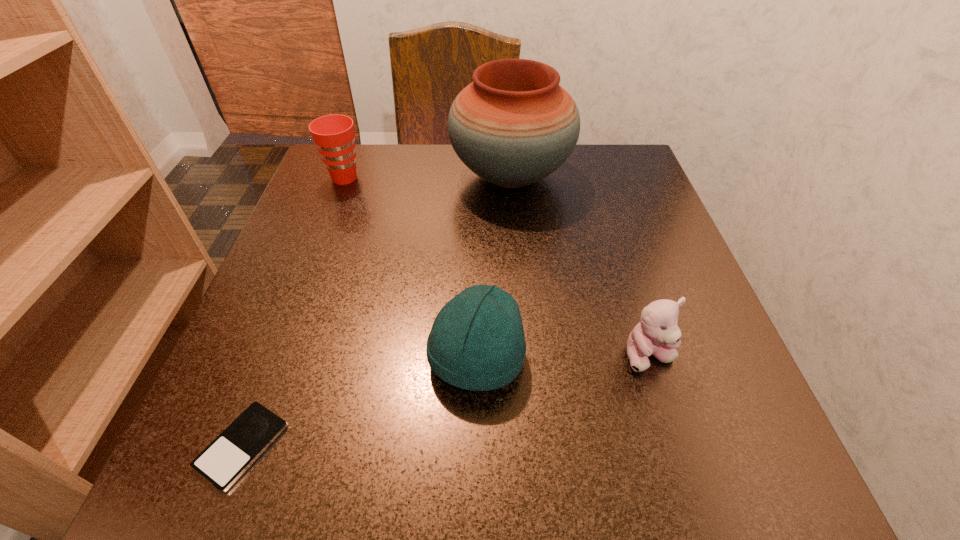
In order to click on free space located on the back of the nearest object in this screenshot , I will do 310,267.

The width and height of the screenshot is (960, 540). Find the location of `pottery at the far edge`. pottery at the far edge is located at coordinates (514, 125).

Identify the location of cup located at the far edge. This screenshot has height=540, width=960. [334, 136].

At what (x,y) coordinates should I click in order to perform the action: click on object that is at the near edge. Please return your answer as a coordinate pair (x, y). Looking at the image, I should click on (227, 457).

Where is `cup situated at the left edge`? The height and width of the screenshot is (540, 960). cup situated at the left edge is located at coordinates (334, 136).

The width and height of the screenshot is (960, 540). What are the coordinates of `iPod that is at the left edge` in the screenshot? It's located at (227, 457).

At what (x,y) coordinates should I click in order to perform the action: click on object that is at the right edge. Please return your answer as a coordinate pair (x, y). Image resolution: width=960 pixels, height=540 pixels. Looking at the image, I should click on (657, 334).

Locate an element on the screen. This screenshot has width=960, height=540. object that is at the far left corner is located at coordinates (334, 136).

Where is `object located in the near left corner section of the desktop`? The image size is (960, 540). object located in the near left corner section of the desktop is located at coordinates (227, 457).

At what (x,y) coordinates should I click in order to perform the action: click on vacant space at the far edge. Please return your answer as a coordinate pair (x, y). Looking at the image, I should click on (398, 146).